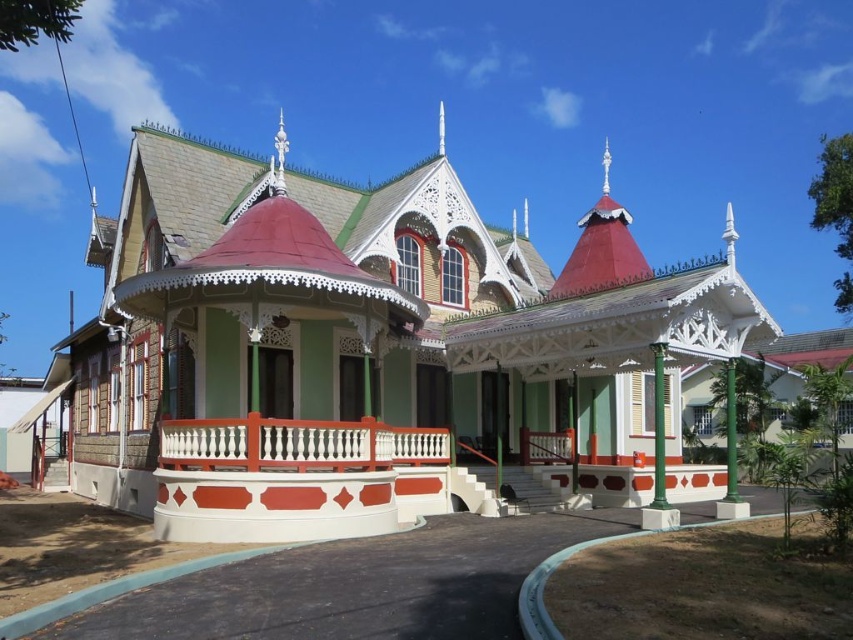
Question: Observing the image, what is the correct spatial positioning of green wood gazebo at center in reference to green painted metal pole at lower right?

Choices:
 (A) above
 (B) below

Answer: (A)

Question: Which object appears farthest from the camera in this image?

Choices:
 (A) green painted metal pole at lower right
 (B) green wood gazebo at center
 (C) white painted wood railing at center

Answer: (A)

Question: Can you confirm if green wood gazebo at center is bigger than white painted wood railing at center?

Choices:
 (A) yes
 (B) no

Answer: (A)

Question: Which of these objects is positioned farthest from the green painted metal pole at lower right?

Choices:
 (A) white painted wood railing at center
 (B) green wood gazebo at center

Answer: (B)

Question: Which point is farther from the camera taking this photo?

Choices:
 (A) (241, 368)
 (B) (204, 458)
 (C) (654, 417)

Answer: (A)

Question: Can you confirm if green wood gazebo at center is bigger than white painted wood railing at center?

Choices:
 (A) no
 (B) yes

Answer: (B)